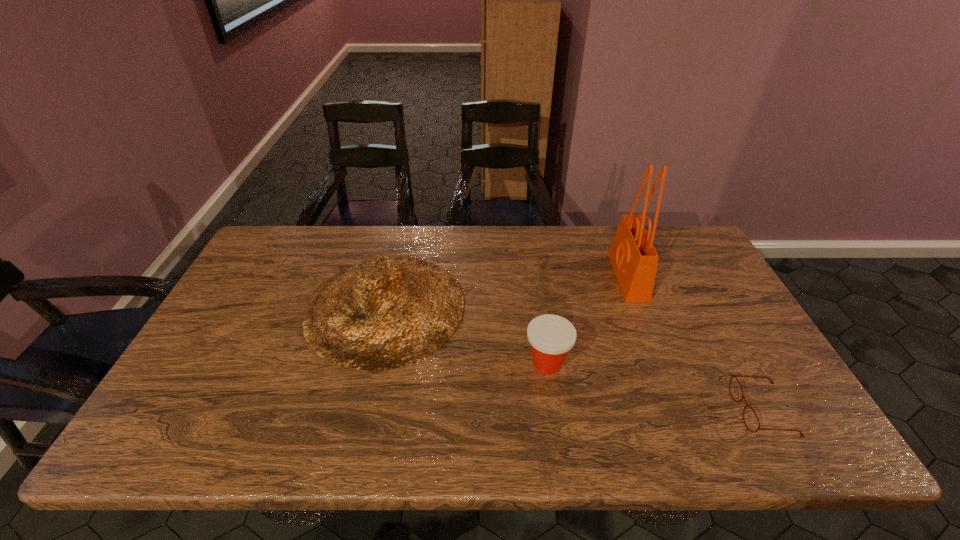
Locate an element on the screen. The image size is (960, 540). blank space located 0.300m on the logo side of the tallest object is located at coordinates (518, 276).

Image resolution: width=960 pixels, height=540 pixels. Find the location of `vacant region located on the front of the third shortest object`. vacant region located on the front of the third shortest object is located at coordinates (358, 427).

In order to click on vacant space situated 0.180m on the right of the third object from right to left in this screenshot , I will do `click(640, 363)`.

What are the coordinates of `vacant space positioned 0.300m on the face of the nearest object` in the screenshot? It's located at (608, 410).

The height and width of the screenshot is (540, 960). Identify the location of free region located on the face of the nearest object. pos(630,410).

This screenshot has width=960, height=540. Identify the location of vacant space located 0.080m on the face of the nearest object. (703, 410).

Image resolution: width=960 pixels, height=540 pixels. What are the coordinates of `tote bag that is at the far edge` in the screenshot? It's located at (634, 259).

The image size is (960, 540). I want to click on sunhat that is at the far edge, so click(x=387, y=312).

I want to click on object present at the near edge, so click(x=732, y=376).

Where is `object situated at the right edge`? object situated at the right edge is located at coordinates (732, 376).